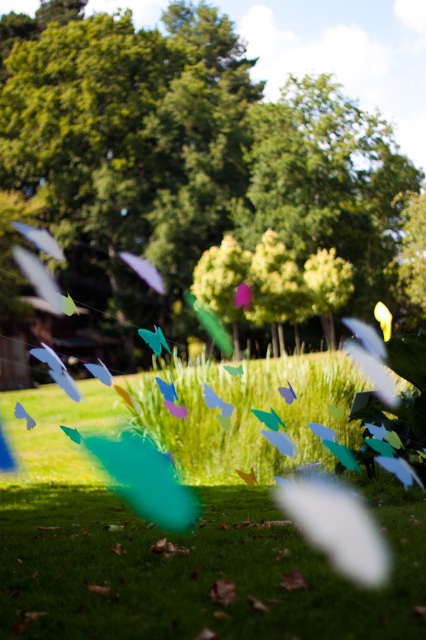
Between green leafy tree at center and green matte grass at center, which one is positioned lower?

green matte grass at center is lower down.

Between point (40, 10) and point (193, 600), which one is positioned in front?

Point (193, 600) is more forward.

Between point (160, 323) and point (330, 598), which one is positioned behind?

Positioned behind is point (160, 323).

Where is `green leafy tree at center`? green leafy tree at center is located at coordinates coord(192,163).